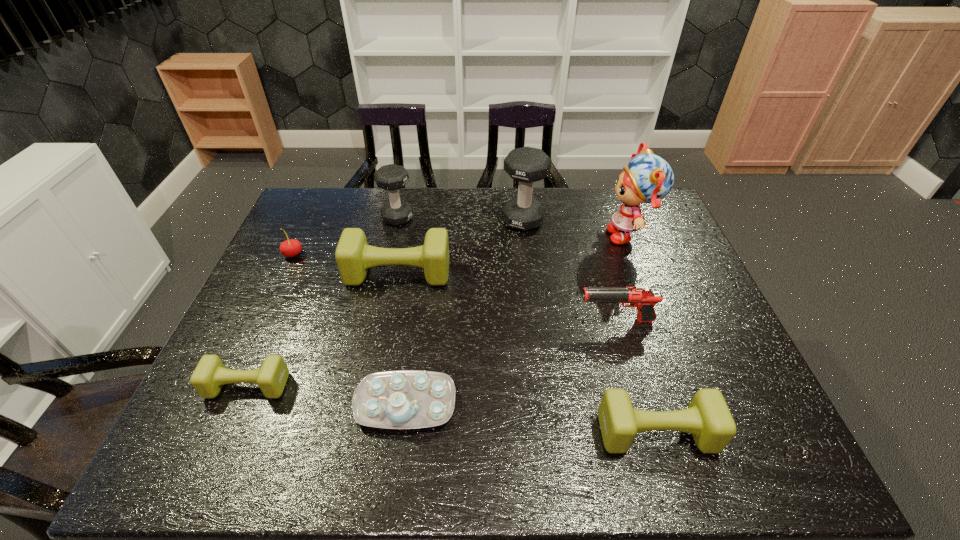
Choose which object is the nearest neighbor to the doll. Please provide its 2D coordinates. Your answer should be formatted as a tuple, i.e. [(x, y)], where the tuple contains the x and y coordinates of a point satisfying the conditions above.

[(527, 165)]

Choose which object is the nearest neighbor to the smallest olive dumbbell. Please provide its 2D coordinates. Your answer should be formatted as a tuple, i.e. [(x, y)], where the tuple contains the x and y coordinates of a point satisfying the conditions above.

[(404, 399)]

Locate which dumbbell is the third closest to the third nearest dumbbell. Please provide its 2D coordinates. Your answer should be formatted as a tuple, i.e. [(x, y)], where the tuple contains the x and y coordinates of a point satisfying the conditions above.

[(209, 376)]

The width and height of the screenshot is (960, 540). I want to click on dumbbell that stands as the closest to the blue chinaware, so click(x=209, y=376).

Locate which olive dumbbell ranks third in proximity to the tallest dumbbell. Please provide its 2D coordinates. Your answer should be formatted as a tuple, i.e. [(x, y)], where the tuple contains the x and y coordinates of a point satisfying the conditions above.

[(209, 376)]

Locate an element on the screen. olive dumbbell that is the second closest to the leftmost olive dumbbell is located at coordinates (707, 417).

I want to click on vacant region that satisfies the following two spatial constraints: 1. at the aiming end of the second smallest olive dumbbell; 2. on the left side of the gun, so click(x=648, y=433).

I want to click on blank area in the image that satisfies the following two spatial constraints: 1. on the front side of the leftmost dumbbell; 2. on the right side of the rightmost dumbbell, so coord(228,433).

The height and width of the screenshot is (540, 960). Find the location of `free space that satisfies the following two spatial constraints: 1. on the face of the doll; 2. on the front side of the nearest dumbbell`. free space that satisfies the following two spatial constraints: 1. on the face of the doll; 2. on the front side of the nearest dumbbell is located at coordinates (706, 433).